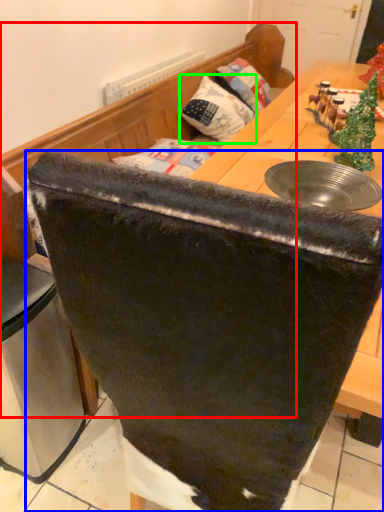
Question: Which object is the closest to the furniture (highlighted by a red box)? Choose among these: chair (highlighted by a blue box) or pillow (highlighted by a green box).

Choices:
 (A) chair
 (B) pillow

Answer: (B)